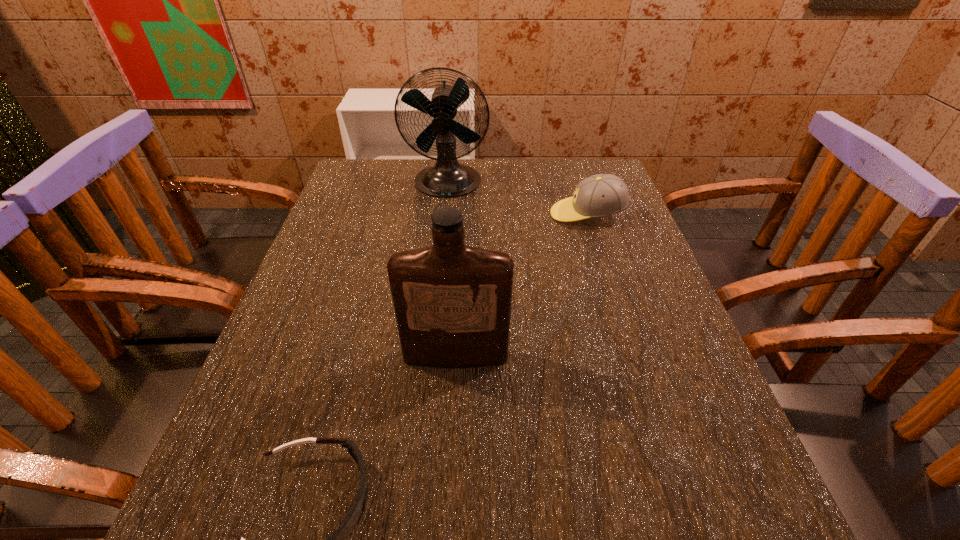
Where is `fan`? fan is located at coordinates point(447,178).

The height and width of the screenshot is (540, 960). What are the coordinates of `liquor` in the screenshot? It's located at [452, 302].

Locate an element on the screen. baseball cap is located at coordinates (600, 195).

You are a GUI agent. You are given a task and a screenshot of the screen. Output one action in this format:
    pyautogui.click(x=<x>, y=<y>)
    Task: Click on the rightmost object
    
    Given the screenshot: What is the action you would take?
    pyautogui.click(x=600, y=195)

I want to click on vacant space located on the front-facing side of the fan, so click(x=437, y=281).

Identify the location of vacant space positioned on the label side of the liquor. The image size is (960, 540). (452, 431).

Where is `blank space located on the front-facing side of the rightmost object`? blank space located on the front-facing side of the rightmost object is located at coordinates (528, 214).

Where is `free region located 0.050m on the front-facing side of the rightmost object`? The height and width of the screenshot is (540, 960). free region located 0.050m on the front-facing side of the rightmost object is located at coordinates (532, 214).

Find the location of a particular element. vacant space located on the front-facing side of the rightmost object is located at coordinates (483, 214).

I want to click on object that is at the far edge, so click(x=447, y=178).